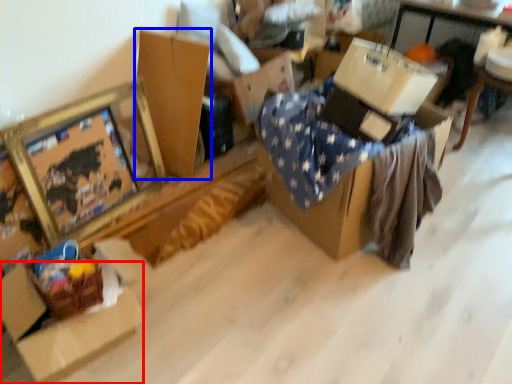
Question: Which of the following is the farthest to the observer, cardboard box (highlighted by a red box) or cardboard box (highlighted by a blue box)?

Choices:
 (A) cardboard box
 (B) cardboard box

Answer: (B)